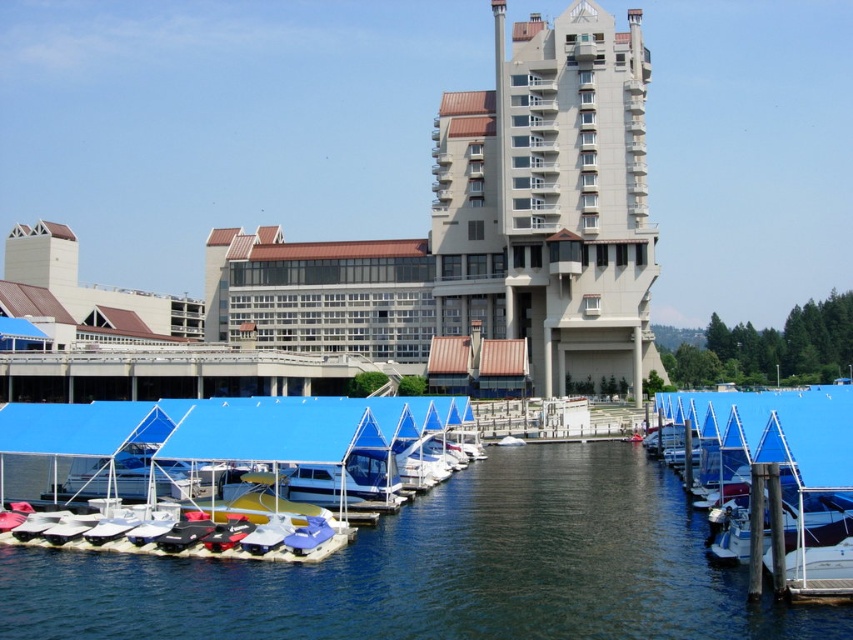
You are a boat operator who wants to move the blue tarpaulin boat at center to the right side of the marina. Given the space between the blue water at center and the nearby boat canopies, do you think there is enough room to maneuver the boat without hitting anything?

The blue water at center is wider than the blue tarpaulin boat at center, so there should be enough space to maneuver the boat to the right side without hitting the nearby boat canopies.

You are standing at the edge of the marina, looking towards the beige concrete building at center. If you want to take a photo that includes both the building and the boats under the blue canopy shelters, which object should you position closer to the camera to ensure they are both in focus?

You should position the boats under the blue canopy shelters closer to the camera because the beige concrete building at center is 356.85 feet away, so adjusting the boats to be nearer will help maintain focus on both subjects.